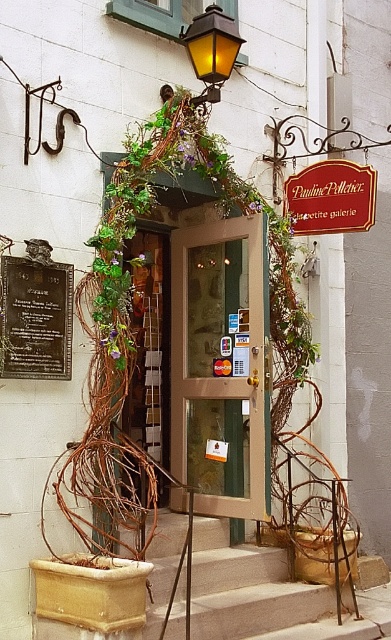
Can you confirm if transparent glass door at center is positioned above wooden sign at center?

No, transparent glass door at center is not above wooden sign at center.

Who is more distant from viewer, (211, 433) or (330, 170)?

The point (330, 170) is behind.

This screenshot has width=391, height=640. I want to click on transparent glass door at center, so click(x=211, y=365).

Does smooth concrete stairs at center have a greater height compared to bronze plaque at center left?

Indeed, smooth concrete stairs at center has a greater height compared to bronze plaque at center left.

Where is `smooth concrete stairs at center`? The image size is (391, 640). smooth concrete stairs at center is located at coordinates (260, 595).

Does transparent glass door at center have a smaller size compared to smooth concrete stairs at center?

Indeed, transparent glass door at center has a smaller size compared to smooth concrete stairs at center.

What do you see at coordinates (211, 365) in the screenshot?
I see `transparent glass door at center` at bounding box center [211, 365].

Locate an element on the screen. The image size is (391, 640). transparent glass door at center is located at coordinates (211, 365).